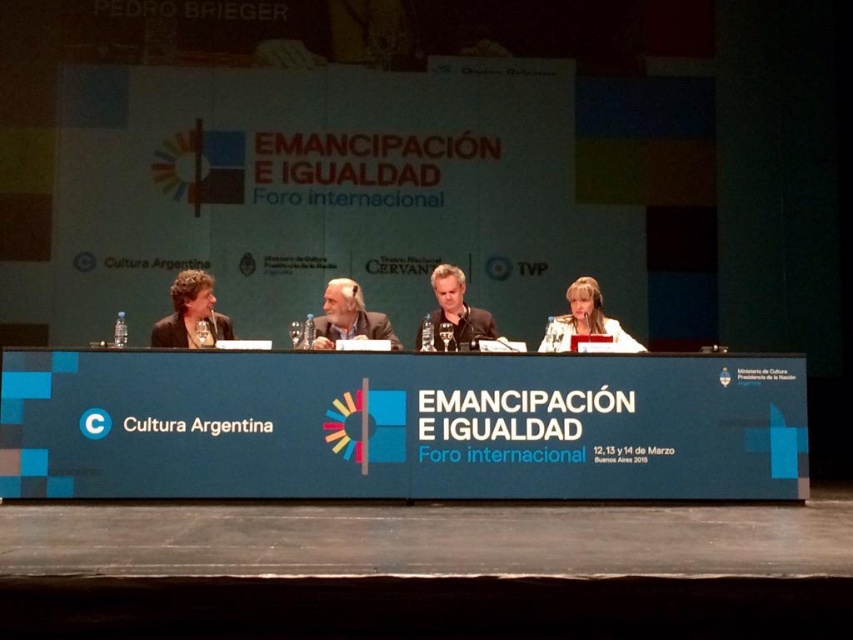
Question: Is matte black jacket at left positioned at the back of gray hair at center?

Choices:
 (A) yes
 (B) no

Answer: (A)

Question: Which point is closer to the camera taking this photo?

Choices:
 (A) (569, 330)
 (B) (335, 300)
 (C) (431, 310)

Answer: (B)

Question: Does blue fabric table at center appear over white fabric at center?

Choices:
 (A) no
 (B) yes

Answer: (A)

Question: Which object is the farthest from the gray hair at center?

Choices:
 (A) matte black shirt at center
 (B) blue fabric table at center
 (C) matte black jacket at left

Answer: (B)

Question: Which point is farther to the camera?

Choices:
 (A) (480, 337)
 (B) (279, 388)
 (C) (572, 321)

Answer: (C)

Question: Is gray hair at center below white fabric at center?

Choices:
 (A) yes
 (B) no

Answer: (A)